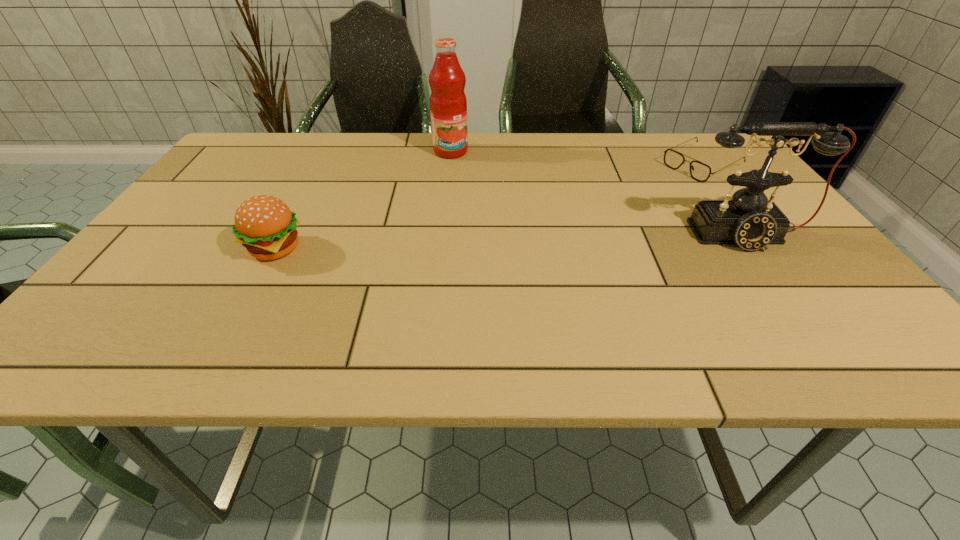
In order to click on hamburger in this screenshot , I will do `click(264, 224)`.

Where is `the leftmost object`? The image size is (960, 540). the leftmost object is located at coordinates (264, 224).

Identify the location of telephone. (749, 220).

Find the location of a particular element. The height and width of the screenshot is (540, 960). fruit juice is located at coordinates (448, 105).

The height and width of the screenshot is (540, 960). Find the location of `sunglasses`. sunglasses is located at coordinates (699, 171).

You are a GUI agent. You are given a task and a screenshot of the screen. Output one action in this format:
    pyautogui.click(x=<x>, y=<y>)
    Task: Click on the free spot located 0.280m on the back of the leftmost object
    
    Given the screenshot: What is the action you would take?
    pyautogui.click(x=319, y=170)

Find the location of `vacant space located on the dial of the third shortest object`. vacant space located on the dial of the third shortest object is located at coordinates (784, 289).

Locate an element on the screen. The height and width of the screenshot is (540, 960). free space located 0.380m on the front label of the fruit juice is located at coordinates (523, 232).

At what (x,y) coordinates should I click in order to perform the action: click on vacant space located 0.150m on the front label of the fruit juice. Please return your answer as a coordinate pair (x, y). The image size is (960, 540). Looking at the image, I should click on (480, 184).

The width and height of the screenshot is (960, 540). What are the coordinates of `vacant space located 0.080m on the front label of the fruit juice` in the screenshot? It's located at 469,172.